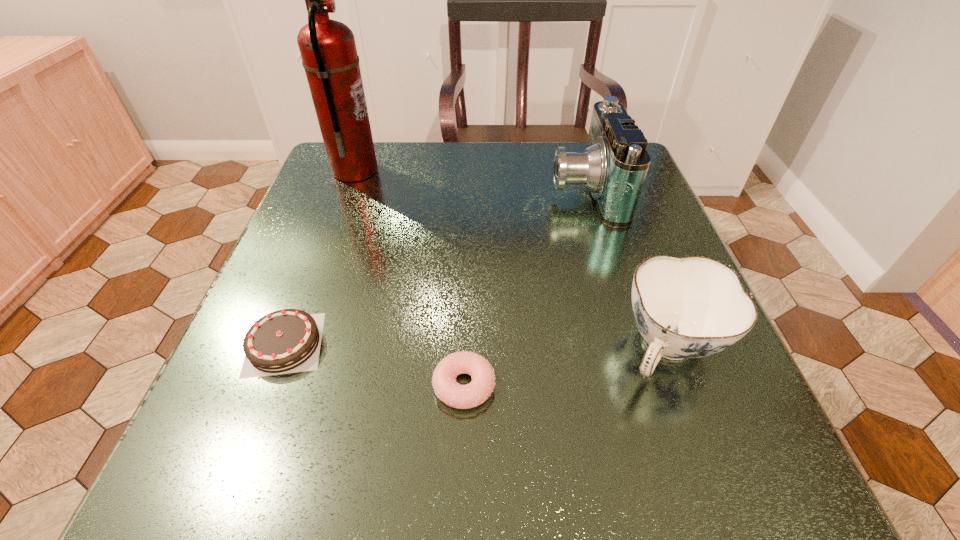
The width and height of the screenshot is (960, 540). Identify the location of the tallest object. (328, 50).

Where is `the fourth shortest object`? This screenshot has height=540, width=960. the fourth shortest object is located at coordinates (614, 165).

The height and width of the screenshot is (540, 960). In order to click on chinaware in this screenshot , I will do `click(692, 307)`.

Locate an element on the screen. chocolate cake is located at coordinates (285, 341).

What are the coordinates of `the third object from left to right` in the screenshot? It's located at (446, 388).

The height and width of the screenshot is (540, 960). I want to click on free region located 0.310m on the nozzle side of the fire extinguisher, so click(x=511, y=171).

This screenshot has width=960, height=540. Identify the location of free spot located on the front-facing side of the second tallest object. coord(404,189).

This screenshot has height=540, width=960. I want to click on vacant space situated 0.250m on the front-facing side of the second tallest object, so click(x=436, y=189).

I want to click on free location located on the front-facing side of the second tallest object, so click(x=463, y=189).

The width and height of the screenshot is (960, 540). I want to click on blank area located on the left of the third tallest object, so click(x=353, y=348).